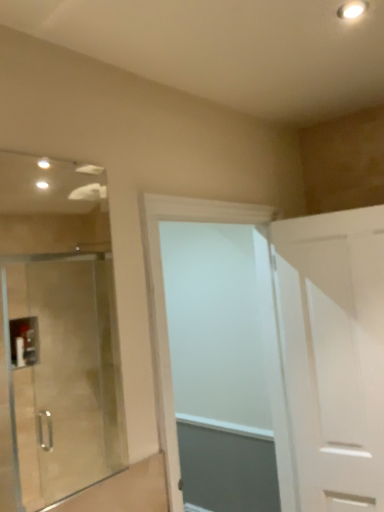
Question: Is white matte door at right, marked as the second door in a left-to-right arrangement, looking in the opposite direction of white matte door at center, which is the first door in left-to-right order?

Choices:
 (A) no
 (B) yes

Answer: (A)

Question: Can you confirm if white matte door at right, marked as the second door in a left-to-right arrangement, is thinner than white matte door at center, which is the first door in left-to-right order?

Choices:
 (A) yes
 (B) no

Answer: (A)

Question: Can we say white matte door at right, which is the 1th door from right to left, lies outside white matte door at center, which is the first door in left-to-right order?

Choices:
 (A) yes
 (B) no

Answer: (A)

Question: From a real-world perspective, does white matte door at right, marked as the second door in a left-to-right arrangement, sit lower than white matte door at center, marked as the 2th door in a right-to-left arrangement?

Choices:
 (A) yes
 (B) no

Answer: (A)

Question: Is white matte door at right, marked as the second door in a left-to-right arrangement, next to white matte door at center, marked as the 2th door in a right-to-left arrangement, and touching it?

Choices:
 (A) yes
 (B) no

Answer: (B)

Question: Could white matte door at center, which is the first door in left-to-right order, be considered to be inside white matte door at right, marked as the second door in a left-to-right arrangement?

Choices:
 (A) yes
 (B) no

Answer: (B)

Question: Considering the relative positions of white matte door at center, which is the first door in left-to-right order, and white matte door at right, which is the 1th door from right to left, in the image provided, is white matte door at center, which is the first door in left-to-right order, to the right of white matte door at right, which is the 1th door from right to left, from the viewer's perspective?

Choices:
 (A) yes
 (B) no

Answer: (B)

Question: Does white matte door at center, marked as the 2th door in a right-to-left arrangement, have a greater height compared to white matte door at right, which is the 1th door from right to left?

Choices:
 (A) yes
 (B) no

Answer: (A)

Question: Considering the relative sizes of white matte door at center, which is the first door in left-to-right order, and white matte door at right, marked as the second door in a left-to-right arrangement, in the image provided, is white matte door at center, which is the first door in left-to-right order, smaller than white matte door at right, marked as the second door in a left-to-right arrangement,?

Choices:
 (A) yes
 (B) no

Answer: (B)

Question: Is white matte door at center, which is the first door in left-to-right order, at the left side of white matte door at right, which is the 1th door from right to left?

Choices:
 (A) no
 (B) yes

Answer: (B)

Question: Is the position of white matte door at center, marked as the 2th door in a right-to-left arrangement, less distant than that of white matte door at right, which is the 1th door from right to left?

Choices:
 (A) yes
 (B) no

Answer: (A)

Question: Can you confirm if white matte door at center, which is the first door in left-to-right order, is wider than white matte door at right, which is the 1th door from right to left?

Choices:
 (A) no
 (B) yes

Answer: (B)

Question: Is white matte door at right, which is the 1th door from right to left, taller or shorter than white matte door at center, marked as the 2th door in a right-to-left arrangement?

Choices:
 (A) tall
 (B) short

Answer: (B)